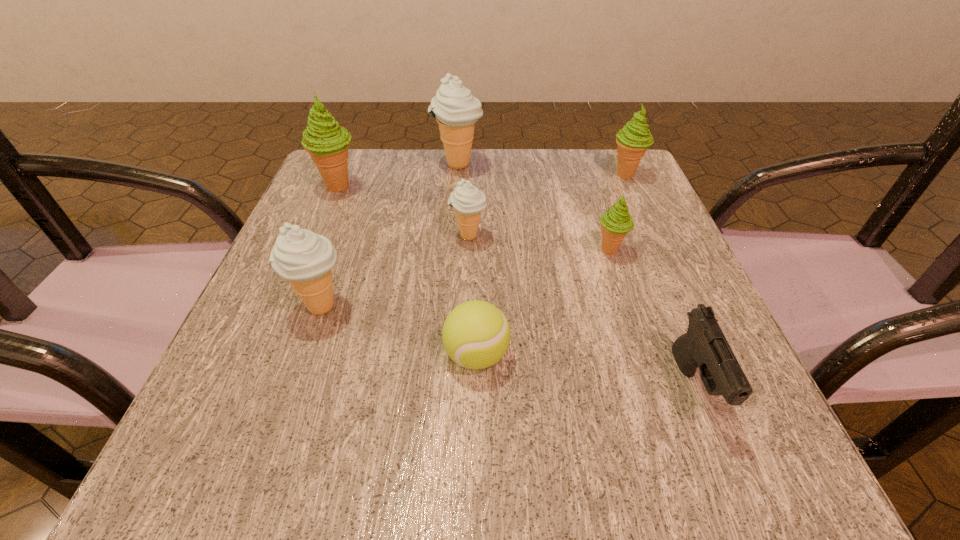
Identify which green icecream is located as the nearest to the smallest green icecream. Please provide its 2D coordinates. Your answer should be formatted as a tuple, i.e. [(x, y)], where the tuple contains the x and y coordinates of a point satisfying the conditions above.

[(633, 139)]

At what (x,y) coordinates should I click in order to perform the action: click on green icecream object that ranks as the closest to the nearest beige icecream. Please return your answer as a coordinate pair (x, y). This screenshot has height=540, width=960. Looking at the image, I should click on (327, 143).

At what (x,y) coordinates should I click in order to perform the action: click on free point that satisfies the following two spatial constraints: 1. on the front side of the green tennis ball; 2. on the right side of the biggest beige icecream. Please return your answer as a coordinate pair (x, y). The image size is (960, 540). Looking at the image, I should click on (444, 355).

The width and height of the screenshot is (960, 540). In order to click on vacant region that satisfies the following two spatial constraints: 1. on the back side of the fifth icecream from left to right; 2. on the left side of the nearest icecream in this screenshot , I will do `click(341, 251)`.

This screenshot has width=960, height=540. What are the coordinates of `vacant region that satisfies the following two spatial constraints: 1. on the front side of the second farthest beige icecream; 2. on the right side of the leftmost green icecream` in the screenshot? It's located at (318, 237).